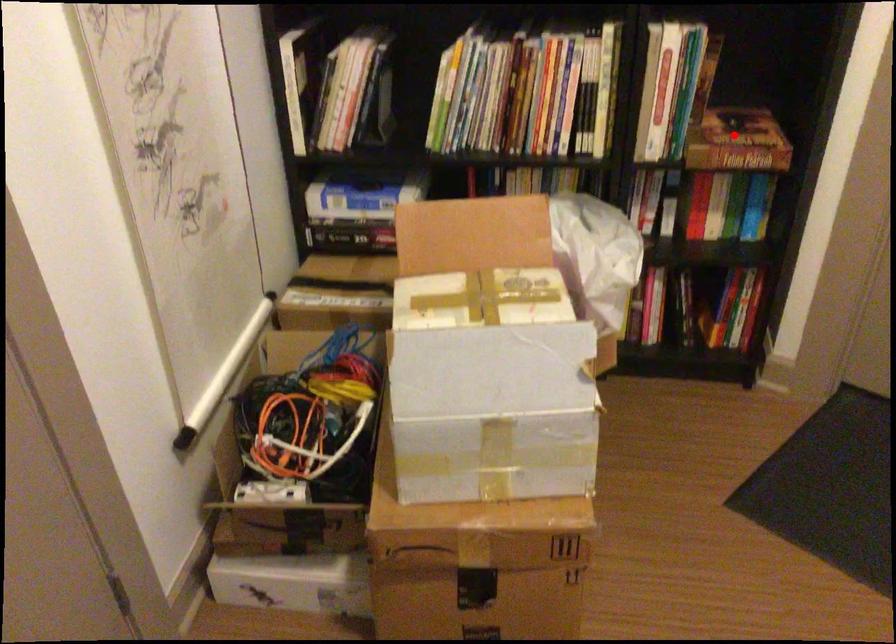
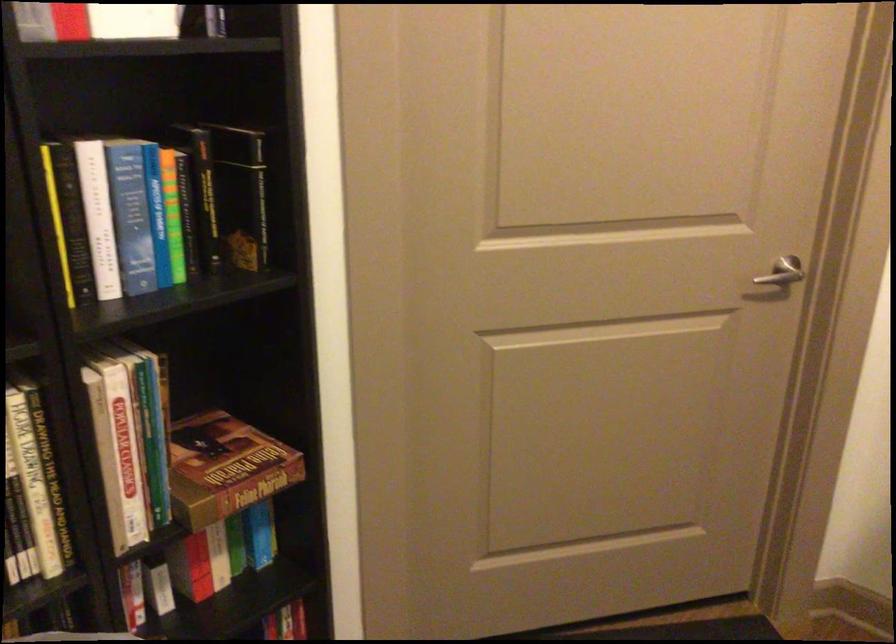
The point at the highlighted location is marked in the first image. Where is the corresponding point in the second image?

(225, 468)